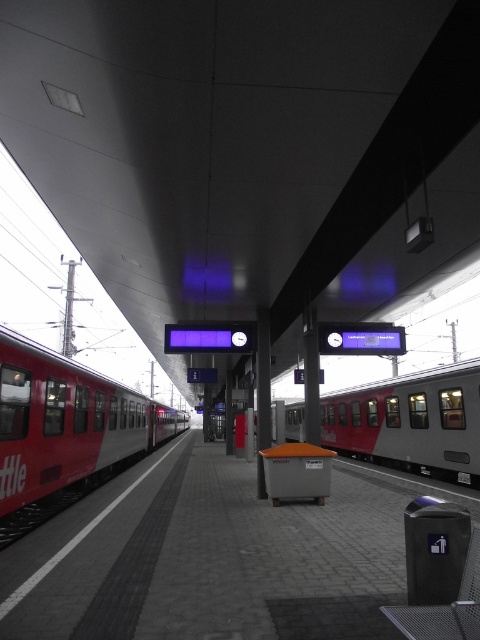
You are standing on the train station platform at night. You see a point marked at coordinates [64,432]. Which object does this point correspond to?

The point at [64,432] marks the red matte train at left.